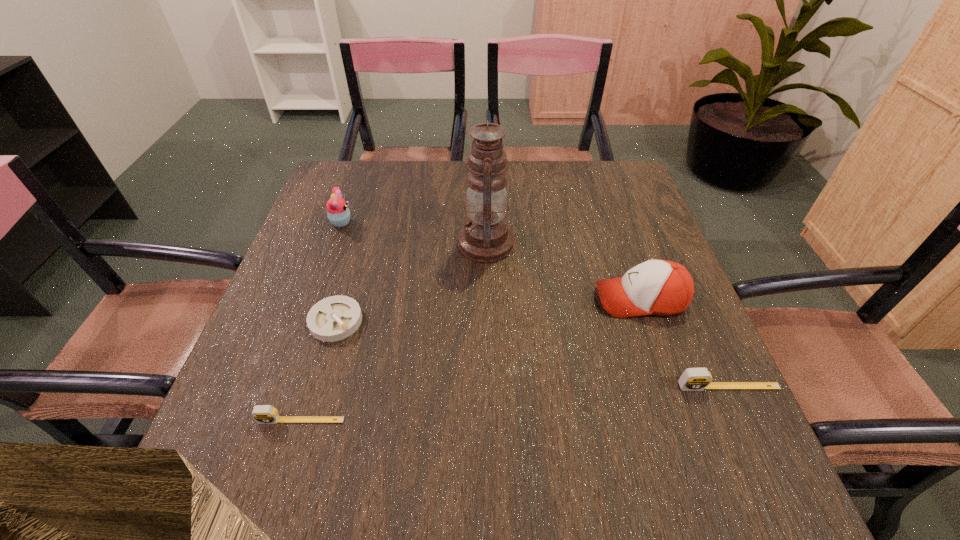
Where is `vacant space that is in between the third object from right to left and the farther tape measure`? vacant space that is in between the third object from right to left and the farther tape measure is located at coordinates (608, 315).

Point out which object is positioned as the fifth nearest to the second nearest object. Please provide its 2D coordinates. Your answer should be formatted as a tuple, i.e. [(x, y)], where the tuple contains the x and y coordinates of a point satisfying the conditions above.

[(338, 213)]

Locate an element on the screen. This screenshot has width=960, height=540. object that is the fourth closest to the left tape measure is located at coordinates (659, 287).

This screenshot has width=960, height=540. Identify the location of free point that satisfies the following two spatial constraints: 1. on the face of the cupcake; 2. on the right side of the oil lamp. (333, 243).

Find the location of `vacant space that satisfies the following two spatial constraints: 1. on the face of the shortest object; 2. on the right side of the cupcake`. vacant space that satisfies the following two spatial constraints: 1. on the face of the shortest object; 2. on the right side of the cupcake is located at coordinates (305, 321).

This screenshot has width=960, height=540. What are the coordinates of `vacant point that satisfies the following two spatial constraints: 1. on the face of the cupcake; 2. on the right side of the ashtray` in the screenshot? It's located at (305, 321).

The image size is (960, 540). Find the location of `free location that satisfies the following two spatial constraints: 1. on the front-facing side of the baseball cap; 2. at the front of the nearest object with the tape extended`. free location that satisfies the following two spatial constraints: 1. on the front-facing side of the baseball cap; 2. at the front of the nearest object with the tape extended is located at coordinates (683, 420).